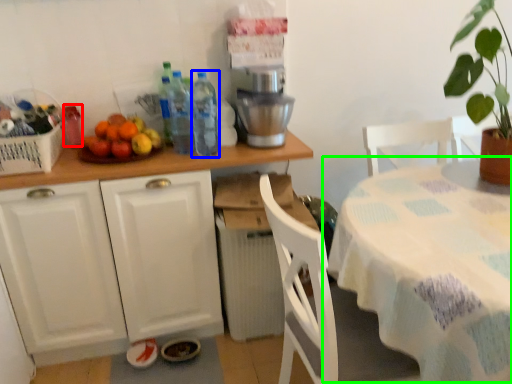
Question: Which object is positioned closest to bottle (highlighted by a red box)? Select from bottle (highlighted by a blue box) and table (highlighted by a green box).

Choices:
 (A) bottle
 (B) table

Answer: (A)